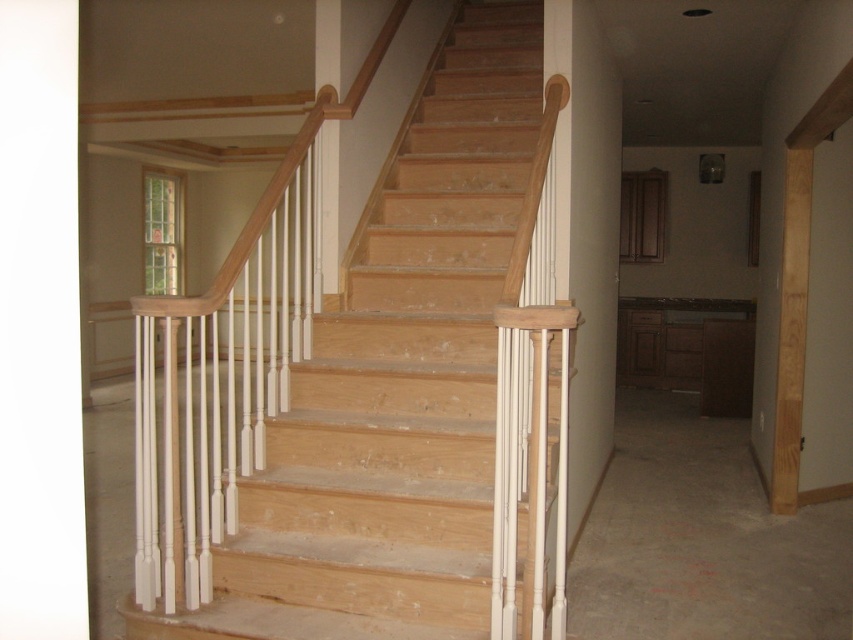
You are a painter who needs to paint two pillars in the staircase area. You have a limited amount of paint. The pillars are labeled as the white painted wood pillar at center and the white wood pillar at center. Which pillar requires more paint because it is larger?

The white painted wood pillar at center requires more paint because it is bigger than the white wood pillar at center according to the description.

Looking at this image, you are standing at the entrance of the room and want to ascend the natural wood stairs at center. Based on the scene description, where exactly are the natural wood stairs positioned relative to the window located to their left?

The natural wood stairs at center are positioned to the right of the window since the window is described as being to the left of the staircase.

You are standing at the bottom of the natural wood stairs at center and want to see the white painted wood pillar at center. Which direction should you look to see it?

You should look behind you because the natural wood stairs at center is in front of the white painted wood pillar at center, so the pillar is behind the stairs from your current position.